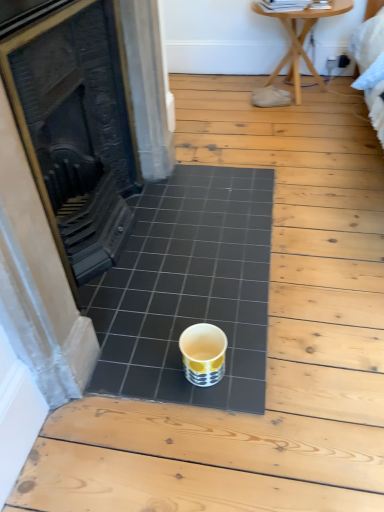
This screenshot has height=512, width=384. In order to click on blank space above black ceramic tile at center (from a real-world perspective) in this screenshot , I will do `click(168, 271)`.